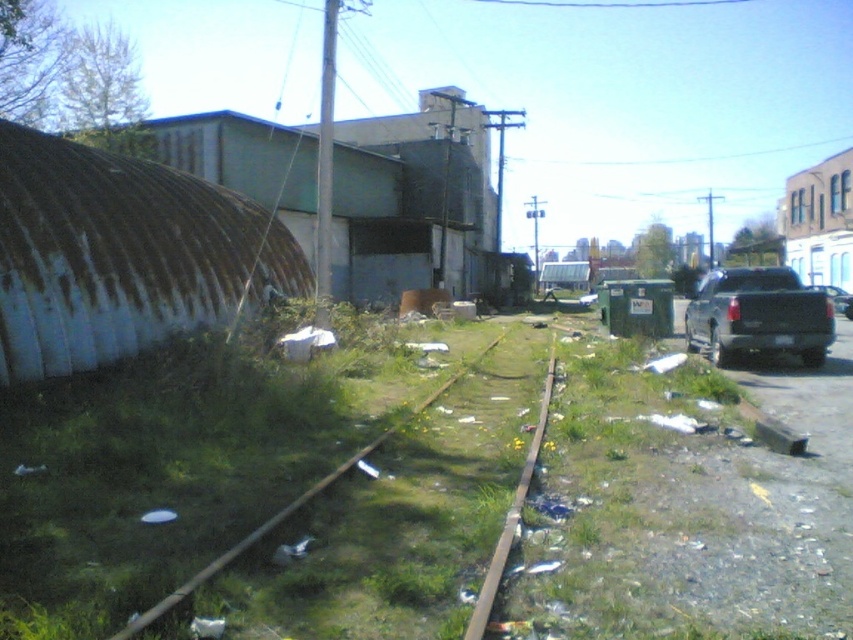
You are a delivery driver who needs to park your metallic gray truck at right near the green grassy train track at center. Based on the scene, can you safely park the truck on the train track?

The green grassy train track at center is to the left of the metallic gray truck at right. Since the tracks are described as disused and littered with debris, it might be unsafe to park there due to potential unstable ground or hazards from the debris. However, the exact spatial relationship suggests the truck is already positioned to the right of the tracks, so parking on the track would require moving leftward. But since the tracks are disused, there may not be active trains, but debris and grass suggest

You are a delivery driver who needs to cross the green grassy train track at center with your metallic gray truck at right. Is there enough clearance for the truck to pass over the tracks without getting stuck?

The green grassy train track at center is positioned under the metallic gray truck at right, which means the truck is already over or near the tracks. Since the tracks are covered in grass and debris but not elevated, there should be sufficient clearance for the truck to pass safely.

You are a maintenance worker inspecting the railroad tracks in the urban area. You notice two tracks labeled as green grass train track at center and green grassy train track at center. Which track has a higher elevation?

The green grass train track at center is taller than the green grassy train track at center, so it has a higher elevation.